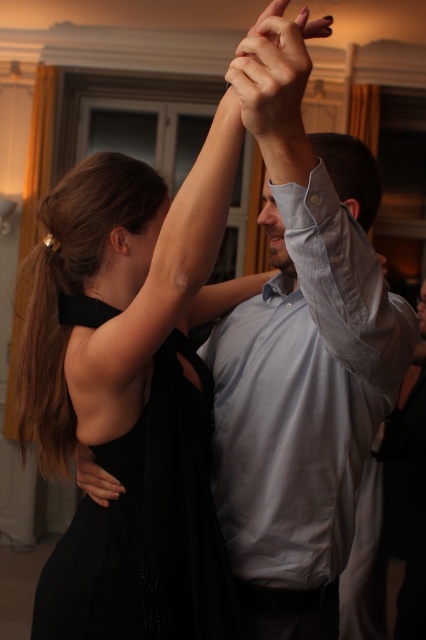
Is black satin dress at center in front of matte skin at upper center?

No.

Is black satin dress at center further to camera compared to matte skin at upper center?

Yes, black satin dress at center is behind matte skin at upper center.

Is point (134, 444) positioned after point (290, 97)?

Yes, it is.

The width and height of the screenshot is (426, 640). I want to click on black satin dress at center, so click(147, 529).

Is matte skin at upper center thinner than black satin dress at lower left?

In fact, matte skin at upper center might be wider than black satin dress at lower left.

Is matte skin at upper center shorter than black satin dress at lower left?

No, matte skin at upper center is not shorter than black satin dress at lower left.

Between point (293, 100) and point (80, 449), which one is positioned in front?

Positioned in front is point (293, 100).

At what (x,y) coordinates should I click in order to perform the action: click on matte skin at upper center. Please return your answer as a coordinate pair (x, y). Looking at the image, I should click on (275, 76).

Can you confirm if black satin dress at center is wider than black satin dress at lower left?

Yes.

Image resolution: width=426 pixels, height=640 pixels. What do you see at coordinates (147, 529) in the screenshot?
I see `black satin dress at center` at bounding box center [147, 529].

Is point (201, 564) positioned in front of point (89, 452)?

Yes, point (201, 564) is closer to viewer.

This screenshot has height=640, width=426. Identify the location of black satin dress at center. (147, 529).